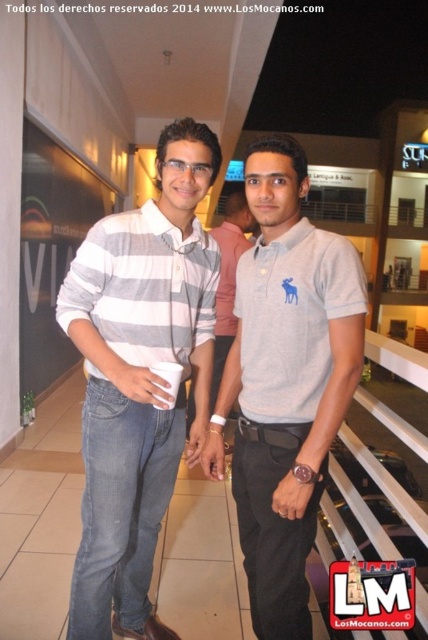
Between gray cotton polo shirt at center and gray striped polo shirt at center, which one has less height?

Standing shorter between the two is gray cotton polo shirt at center.

Is gray cotton polo shirt at center above gray striped polo shirt at center?

No, gray cotton polo shirt at center is not above gray striped polo shirt at center.

What do you see at coordinates (285, 381) in the screenshot?
I see `gray cotton polo shirt at center` at bounding box center [285, 381].

At what (x,y) coordinates should I click in order to perform the action: click on gray cotton polo shirt at center. Please return your answer as a coordinate pair (x, y). This screenshot has width=428, height=640. Looking at the image, I should click on (285, 381).

Which is in front, point (100, 369) or point (293, 257)?

Point (293, 257) is in front.

Does gray striped polo shirt at left appear on the left side of gray cotton polo shirt at center?

Correct, you'll find gray striped polo shirt at left to the left of gray cotton polo shirt at center.

You are a GUI agent. You are given a task and a screenshot of the screen. Output one action in this format:
    pyautogui.click(x=<x>, y=<y>)
    Task: Click on the gray striped polo shirt at left
    The width and height of the screenshot is (428, 640).
    Given the screenshot: What is the action you would take?
    pyautogui.click(x=139, y=378)

Is gray striped polo shirt at left wider than gray striped polo shirt at center?

Indeed, gray striped polo shirt at left has a greater width compared to gray striped polo shirt at center.

Does gray striped polo shirt at left have a smaller size compared to gray striped polo shirt at center?

Yes, gray striped polo shirt at left is smaller than gray striped polo shirt at center.

This screenshot has height=640, width=428. What do you see at coordinates (139, 378) in the screenshot?
I see `gray striped polo shirt at left` at bounding box center [139, 378].

Find the location of a particular element. The width and height of the screenshot is (428, 640). gray striped polo shirt at left is located at coordinates (139, 378).